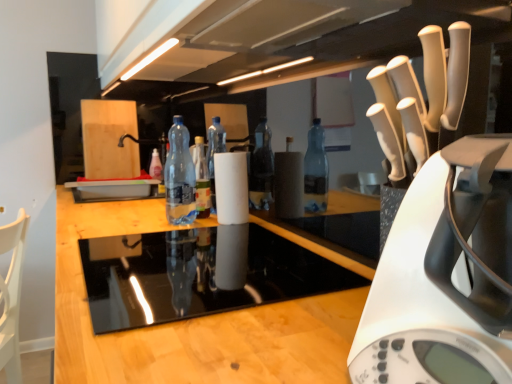
Question: From the image's perspective, is white plastic kettle at right above or below translucent plastic bottle at center, the first bottle viewed from the left?

Choices:
 (A) above
 (B) below

Answer: (B)

Question: Considering the positions of white plastic kettle at right and translucent plastic bottle at center, the second bottle when ordered from right to left, in the image, is white plastic kettle at right taller or shorter than translucent plastic bottle at center, the second bottle when ordered from right to left,?

Choices:
 (A) tall
 (B) short

Answer: (A)

Question: Which object is positioned closest to the black glass stovetop at center?

Choices:
 (A) white plastic kettle at right
 (B) translucent plastic bottle at center, the second bottle when ordered from right to left
 (C) transparent plastic bottle at center, the 1th bottle when ordered from front to back

Answer: (A)

Question: Estimate the real-world distances between objects in this image. Which object is farther from the black glass stovetop at center?

Choices:
 (A) transparent plastic bottle at center, which is counted as the second bottle, starting from the back
 (B) translucent plastic bottle at center, the second bottle when ordered from right to left
 (C) white plastic kettle at right

Answer: (B)